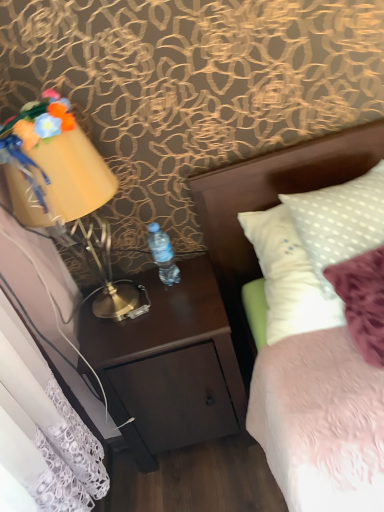
Question: Considering the relative sizes of matte yellow lampshade at left and dark wood nightstand at center in the image provided, is matte yellow lampshade at left thinner than dark wood nightstand at center?

Choices:
 (A) no
 (B) yes

Answer: (B)

Question: Is matte yellow lampshade at left surrounding dark wood nightstand at center?

Choices:
 (A) no
 (B) yes

Answer: (A)

Question: Can you confirm if matte yellow lampshade at left is wider than dark wood nightstand at center?

Choices:
 (A) no
 (B) yes

Answer: (A)

Question: From a real-world perspective, is matte yellow lampshade at left physically above dark wood nightstand at center?

Choices:
 (A) no
 (B) yes

Answer: (B)

Question: Can you confirm if matte yellow lampshade at left is positioned to the left of dark wood nightstand at center?

Choices:
 (A) no
 (B) yes

Answer: (B)

Question: Considering the positions of clear plastic bottle at center and fluffy fabric flowers at upper left in the image, is clear plastic bottle at center bigger or smaller than fluffy fabric flowers at upper left?

Choices:
 (A) big
 (B) small

Answer: (B)

Question: In the image, is clear plastic bottle at center positioned in front of or behind fluffy fabric flowers at upper left?

Choices:
 (A) behind
 (B) front

Answer: (A)

Question: In terms of width, does clear plastic bottle at center look wider or thinner when compared to fluffy fabric flowers at upper left?

Choices:
 (A) wide
 (B) thin

Answer: (B)

Question: Do you think clear plastic bottle at center is within fluffy fabric flowers at upper left, or outside of it?

Choices:
 (A) inside
 (B) outside

Answer: (B)

Question: Looking at the image, does white fabric headboard at upper right seem bigger or smaller compared to clear plastic bottle at center?

Choices:
 (A) big
 (B) small

Answer: (A)

Question: Considering the positions of white fabric headboard at upper right and clear plastic bottle at center in the image, is white fabric headboard at upper right taller or shorter than clear plastic bottle at center?

Choices:
 (A) short
 (B) tall

Answer: (B)

Question: In terms of width, does white fabric headboard at upper right look wider or thinner when compared to clear plastic bottle at center?

Choices:
 (A) wide
 (B) thin

Answer: (A)

Question: From the image's perspective, is white fabric headboard at upper right positioned above or below clear plastic bottle at center?

Choices:
 (A) below
 (B) above

Answer: (B)

Question: Looking at their shapes, would you say matte yellow lampshade at left is wider or thinner than fluffy fabric flowers at upper left?

Choices:
 (A) thin
 (B) wide

Answer: (B)

Question: Considering the relative positions of matte yellow lampshade at left and fluffy fabric flowers at upper left in the image provided, is matte yellow lampshade at left to the left or to the right of fluffy fabric flowers at upper left?

Choices:
 (A) left
 (B) right

Answer: (B)